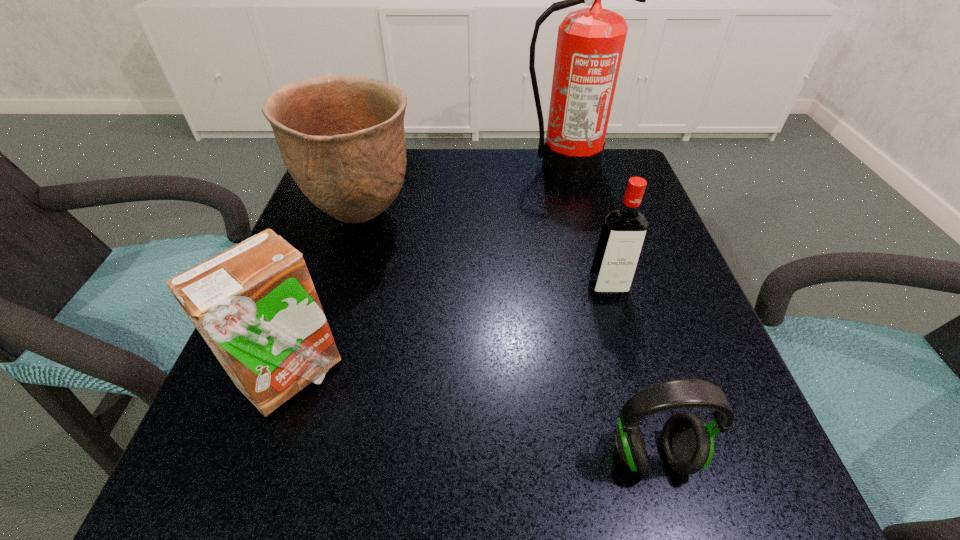
Identify the location of free spot located on the straw side of the second nearest object. This screenshot has width=960, height=540. (468, 376).

You are a GUI agent. You are given a task and a screenshot of the screen. Output one action in this format:
    pyautogui.click(x=<x>, y=<y>)
    Task: Click on the fire extinguisher that is positioned at the far edge
    
    Given the screenshot: What is the action you would take?
    pyautogui.click(x=590, y=42)

Where is `pottery at the far edge`? Image resolution: width=960 pixels, height=540 pixels. pottery at the far edge is located at coordinates (342, 139).

You are a GUI agent. You are given a task and a screenshot of the screen. Output one action in this format:
    pyautogui.click(x=<x>, y=<y>)
    Task: Click on the object that is at the near edge
    
    Given the screenshot: What is the action you would take?
    pyautogui.click(x=687, y=444)

Where is `pottery located in the left edge section of the desktop`? pottery located in the left edge section of the desktop is located at coordinates (342, 139).

The height and width of the screenshot is (540, 960). Identify the location of carton present at the left edge. (255, 305).

Locate an element on the screen. Image resolution: width=960 pixels, height=540 pixels. fire extinguisher that is at the right edge is located at coordinates coord(590,42).

This screenshot has width=960, height=540. What are the coordinates of `vodka located in the right edge section of the desktop` in the screenshot? It's located at (623, 232).

You are a GUI agent. You are given a task and a screenshot of the screen. Output one action in this format:
    pyautogui.click(x=<x>, y=<y>)
    Task: Click on the headset that is at the right edge
    Image resolution: width=960 pixels, height=540 pixels.
    Given the screenshot: What is the action you would take?
    pyautogui.click(x=687, y=444)

Find the location of `object that is at the far left corner`. object that is at the far left corner is located at coordinates (342, 139).